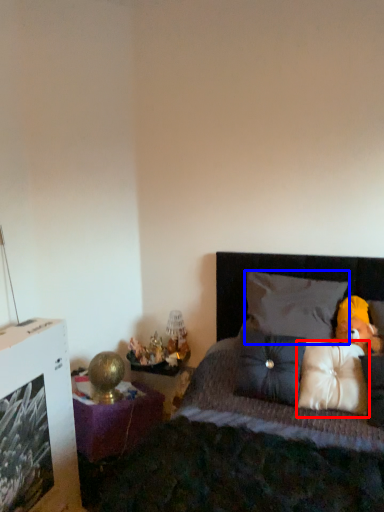
Question: Among these objects, which one is farthest to the camera, pillow (highlighted by a red box) or pillow (highlighted by a blue box)?

Choices:
 (A) pillow
 (B) pillow

Answer: (B)